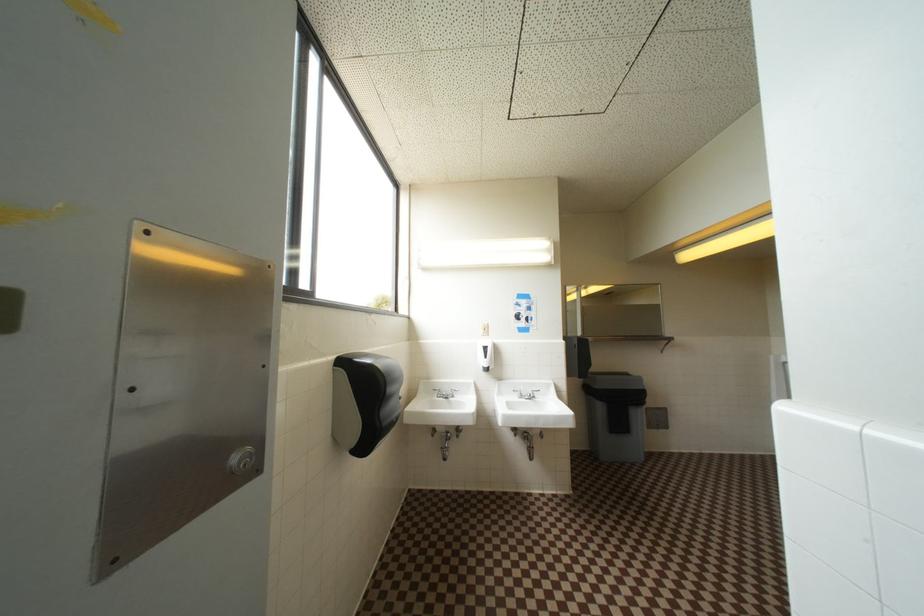
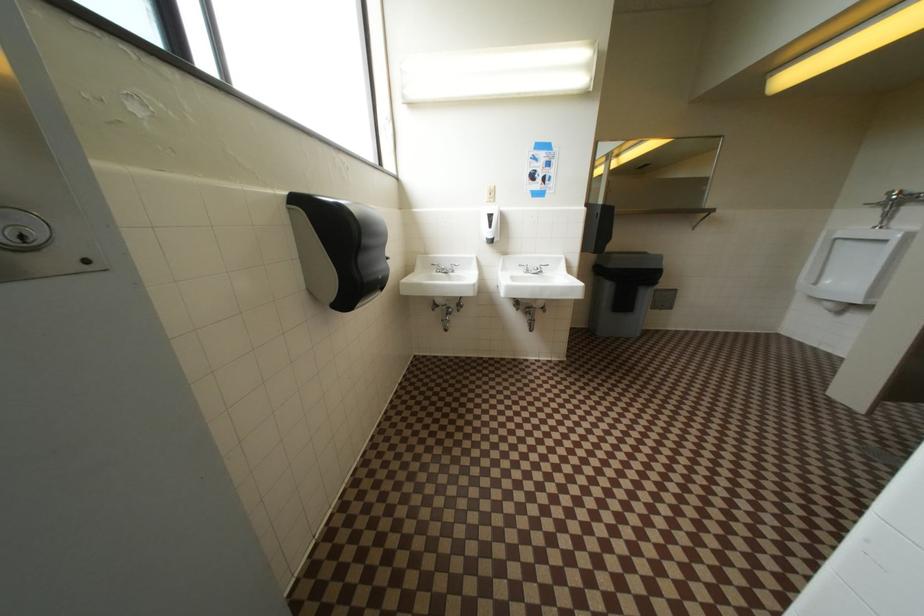
Question: The first image is from the beginning of the video and the second image is from the end. How did the camera likely rotate when shooting the video?

Choices:
 (A) Left
 (B) Right
 (C) Up
 (D) Down

Answer: (D)